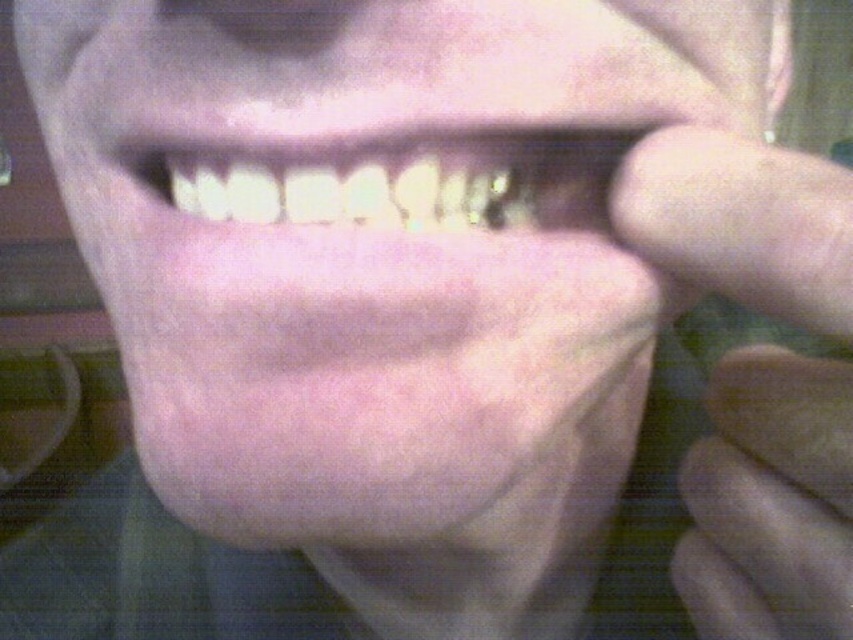
You are a dentist examining a patient. You notice a point at coordinate point (770, 500). Where is this point located in relation to the smooth skin hand at right?

The point at (770, 500) is located at the smooth skin hand at right.

You are a dentist examining a patient. You notice a smooth skin hand at right and white glossy teeth at center in your view. Which object is taller in your line of sight?

The smooth skin hand at right has a greater height compared to the white glossy teeth at center, so the smooth skin hand at right is taller.

You are a dentist examining a patient. You notice a smooth skin hand at right and white glossy teeth at center in your view. Which object is narrower in width?

The smooth skin hand at right is thinner than white glossy teeth at center, so the smooth skin hand at right is narrower in width.